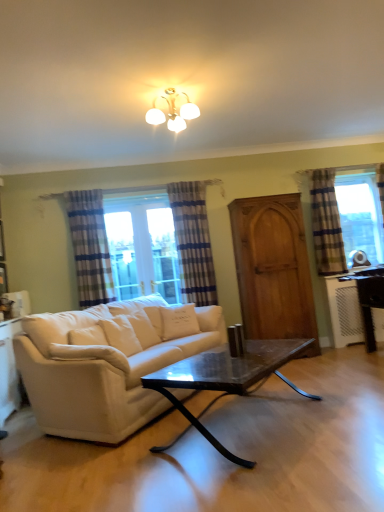
Identify the location of vacant space to the right of marble black coffee table at center. The image size is (384, 512). (348, 411).